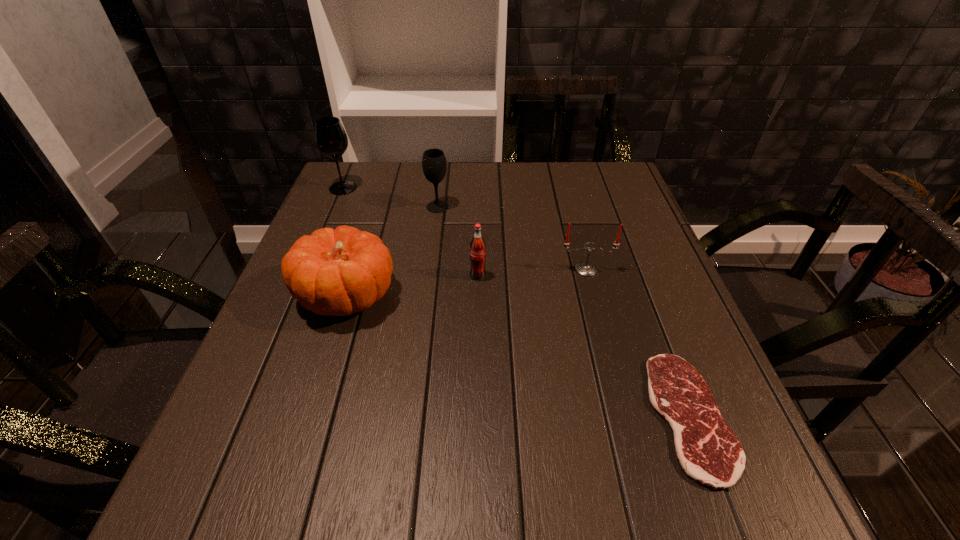
The width and height of the screenshot is (960, 540). I want to click on object that is at the far left corner, so tap(331, 139).

Where is `object positioned at the near right corner`? This screenshot has height=540, width=960. object positioned at the near right corner is located at coordinates (708, 451).

The width and height of the screenshot is (960, 540). Find the location of `free space at the far edge of the desktop`. free space at the far edge of the desktop is located at coordinates (563, 204).

You are a GUI agent. You are given a task and a screenshot of the screen. Output one action in this format:
    pyautogui.click(x=<x>, y=<y>)
    Task: Click on the free space at the near edge of the desktop
    
    Given the screenshot: What is the action you would take?
    pyautogui.click(x=641, y=495)

Image resolution: width=960 pixels, height=540 pixels. Find the location of `vacant space at the right edge of the desktop`. vacant space at the right edge of the desktop is located at coordinates (633, 330).

This screenshot has height=540, width=960. Find the location of `vacant space at the far left corner of the desktop`. vacant space at the far left corner of the desktop is located at coordinates (386, 163).

Identify the location of vacant space at the near left corner of the desktop. The height and width of the screenshot is (540, 960). (234, 477).

Identify the location of free space at the far right corner of the desktop. (600, 172).

Where is `empty space between the steak and the candle`? The image size is (960, 540). empty space between the steak and the candle is located at coordinates (637, 343).

Find the location of a particular element. This screenshot has height=540, width=960. vacant space that is in between the shortest object and the fourth object from left to right is located at coordinates (584, 346).